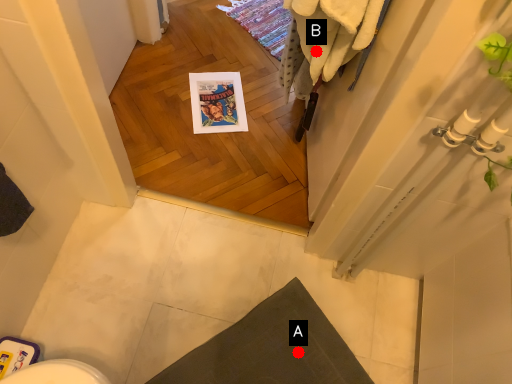
Question: Two points are circled on the image, labeled by A and B beside each circle. Which of the following is the farthest from the observer?

Choices:
 (A) A is further
 (B) B is further

Answer: (A)